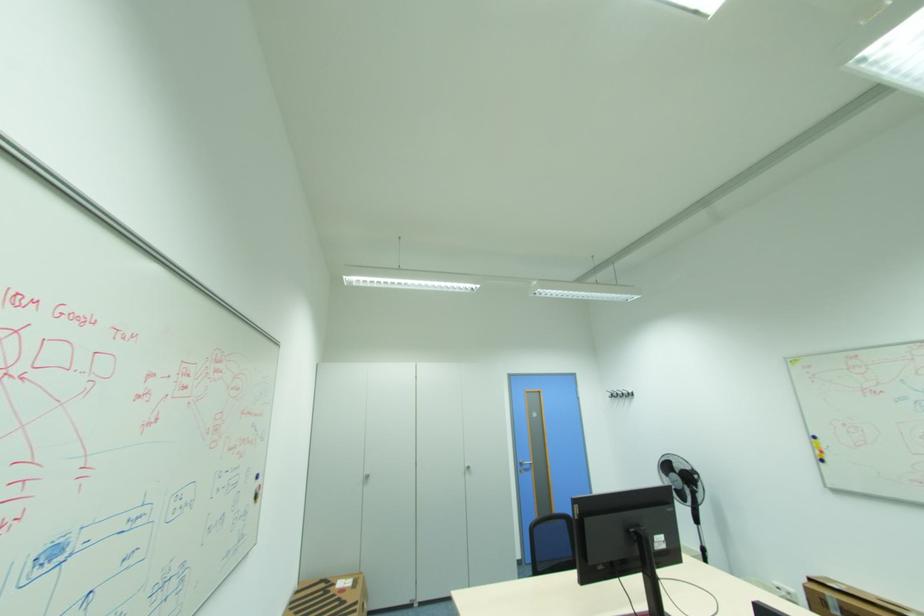
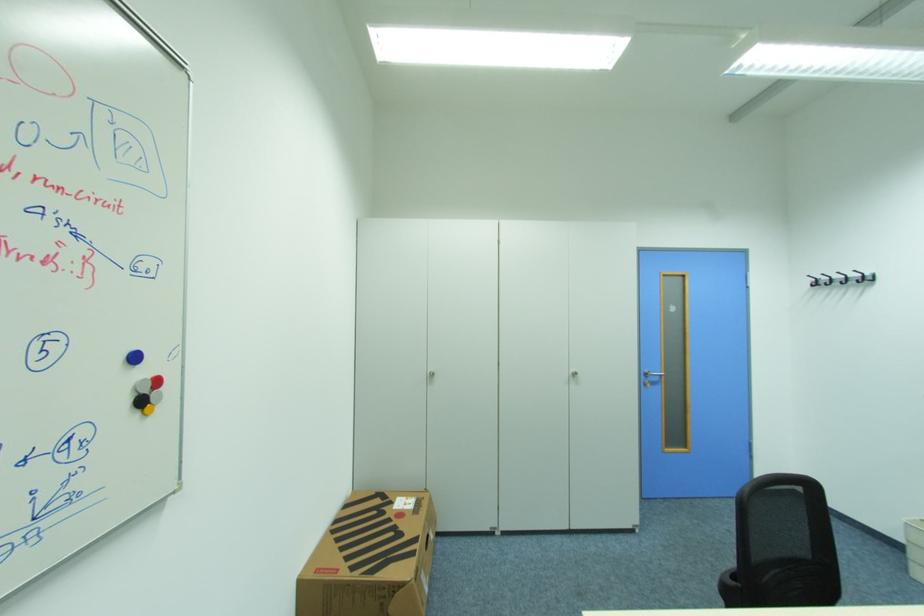
Where in the second image is the point corresponding to (263,477) from the first image?

(140, 359)